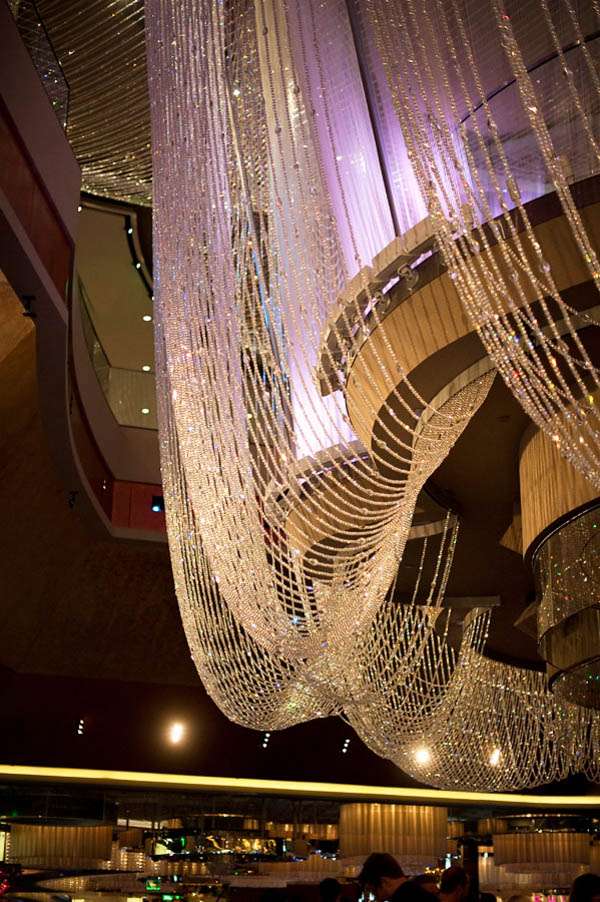
Where is `spotlights`? spotlights is located at coordinates (145, 408), (145, 370), (145, 325), (138, 268), (132, 234), (83, 213), (155, 504), (77, 732), (262, 742), (345, 750).